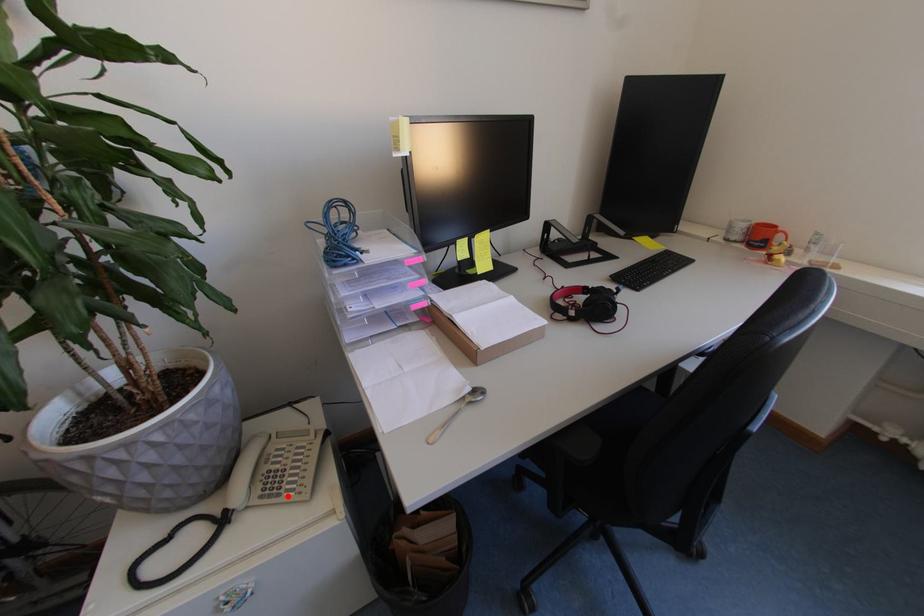
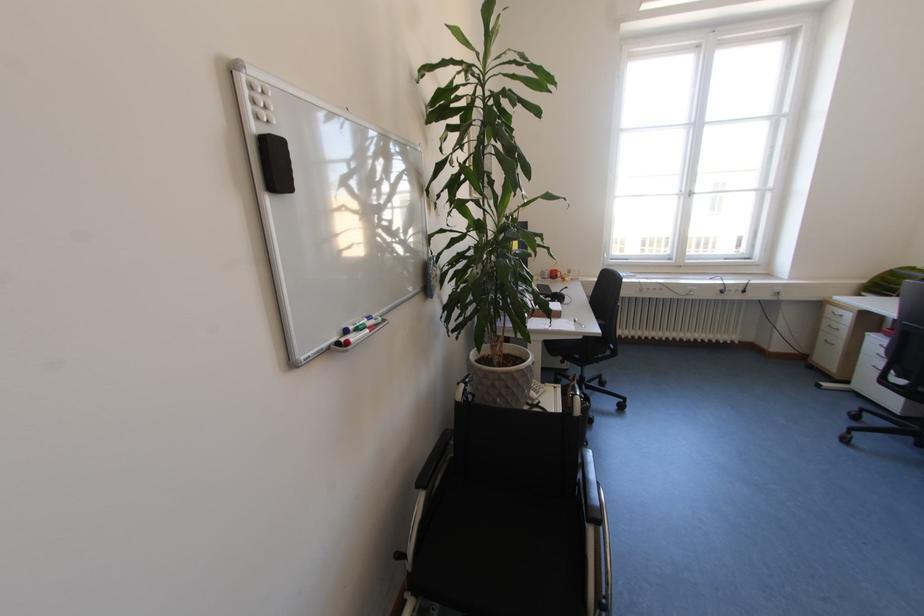
Question: A red point is marked in image1. In image2, is the corresponding 3D point closer to the camera or farther? Reply with the corresponding letter.

Choices:
 (A) The corresponding 3D point is closer.
 (B) The corresponding 3D point is farther.

Answer: (B)